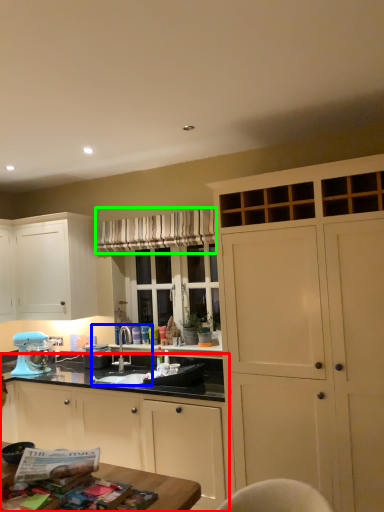
Question: Estimate the real-world distances between objects in this image. Which object is farther from cabinetry (highlighted by a red box), sink (highlighted by a blue box) or curtain (highlighted by a green box)?

Choices:
 (A) sink
 (B) curtain

Answer: (B)